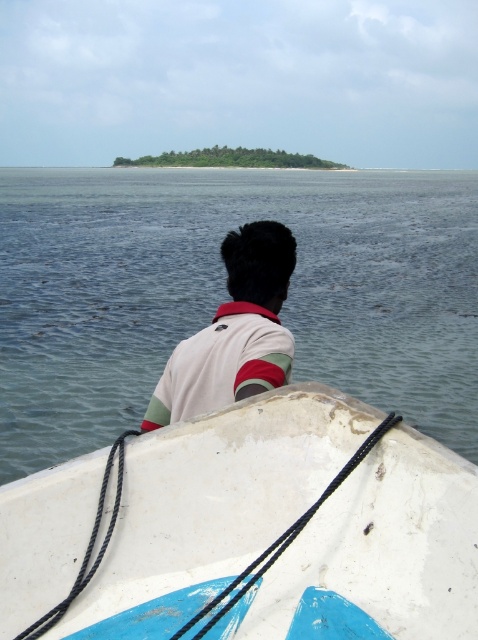
You are standing on the boat and want to know how far you are from the point at coordinates point (178, 186). Can you determine the distance?

The distance between you and the point (178, 186) is 50.27 meters.

In the scene shown: You are a sailor on a mission to measure distances between objects in your boat. You have a measuring tape that can stretch up to 10 meters. You need to determine the distance between the clear water at center and the white matte boat at center. Can your measuring tape reach that distance?

The clear water at center and white matte boat at center are 12.39 meters apart from each other. Since your measuring tape can only stretch up to 10 meters, it cannot reach the required distance between the clear water at center and the white matte boat at center.